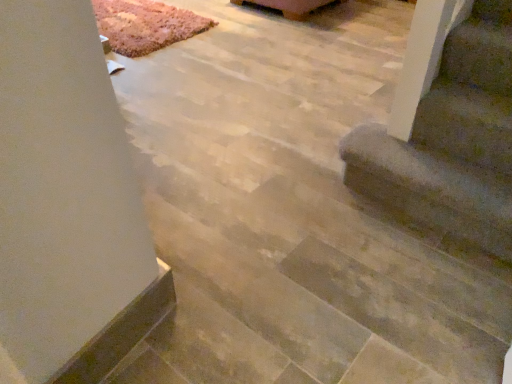
Question: From their relative heights in the image, would you say rug carpet at upper left is taller or shorter than wooden coffee table at upper center?

Choices:
 (A) short
 (B) tall

Answer: (A)

Question: Based on their positions, is rug carpet at upper left located to the left or right of wooden coffee table at upper center?

Choices:
 (A) right
 (B) left

Answer: (B)

Question: Which object is the closest to the rug carpet at upper left?

Choices:
 (A) wooden coffee table at upper center
 (B) brown fuzzy carpet at lower right

Answer: (A)

Question: Which object is positioned closest to the rug carpet at upper left?

Choices:
 (A) brown fuzzy carpet at lower right
 (B) wooden coffee table at upper center

Answer: (B)